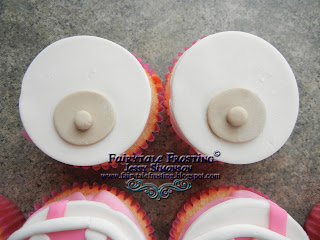
Where is `gray table`? The image size is (320, 240). gray table is located at coordinates (162, 37).